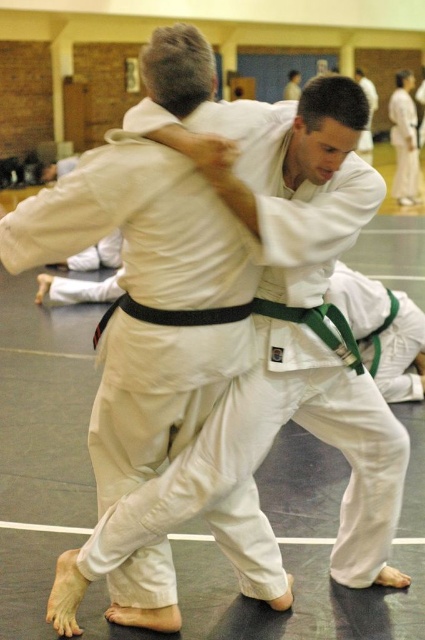
Looking at this image, you are a referee observing a judo match. You notice the green belt at lower right and the white karate gi at center. Which competitor is positioned closer to the front of the mat?

The green belt at lower right is positioned closer to the front of the mat because the white karate gi at center is behind it.

You are a judo instructor observing a training session. You notice the green belt at lower right and the white karate gi at center. Which of these two participants is more likely to be the one executing the hold or throw? Explain your reasoning based on their positions and the description provided.

The green belt at lower right is more likely to be executing the hold or throw since they are positioned closer to the action and their smaller size compared to the white karate gi at center suggests they might be applying a technique requiring leverage, such as a throw or hold, which often involves using body positioning and strength relative to the opponent.